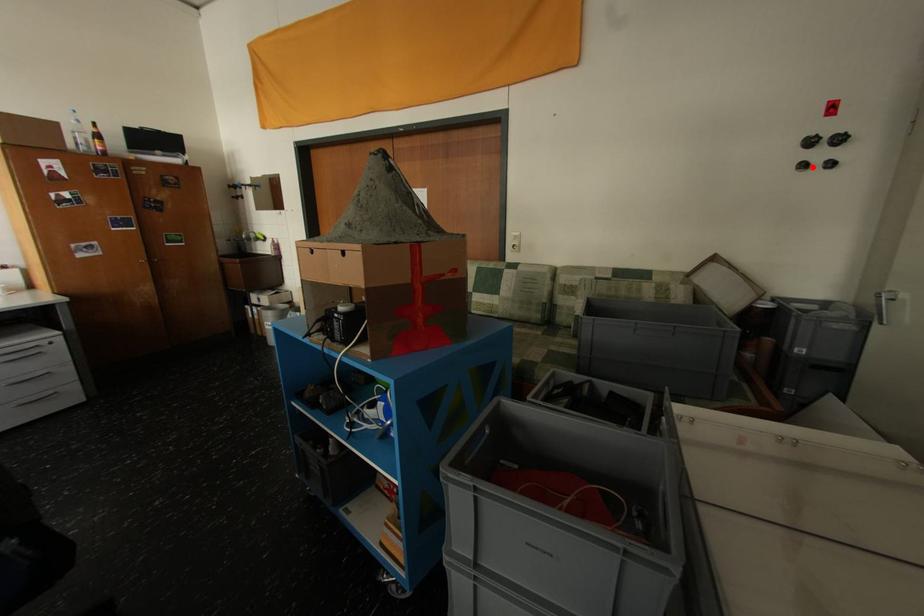
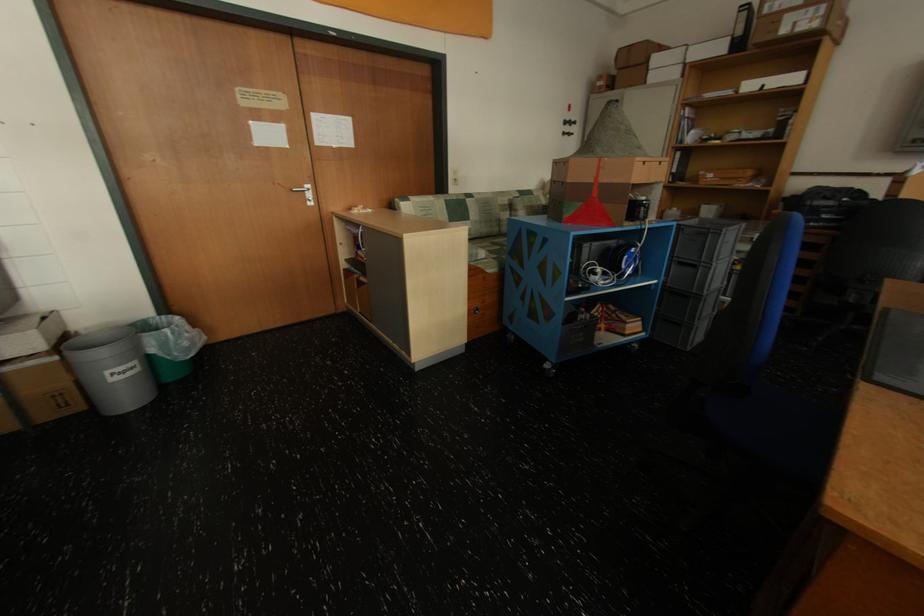
Question: I am providing you with two images of the same scene from different viewpoints. A red point is shown in image1. For the corresponding object point in image2, is it positioned nearer or farther from the camera?

Choices:
 (A) Nearer
 (B) Farther

Answer: (A)